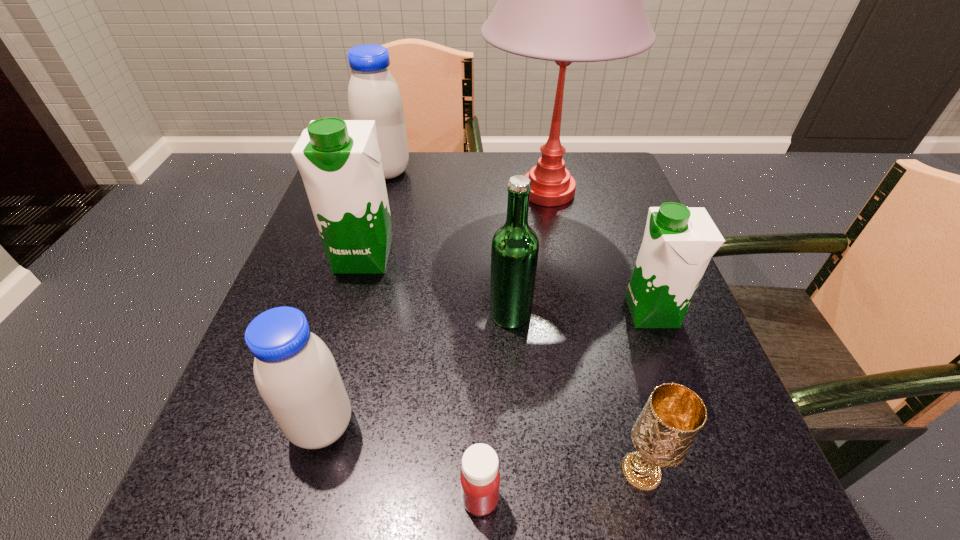
You are a GUI agent. You are given a task and a screenshot of the screen. Output one action in this format:
    pyautogui.click(x=<x>, y=<y>)
    Task: Click on the free space between the medicine and the second farthest soya milk
    The height and width of the screenshot is (540, 960).
    Given the screenshot: What is the action you would take?
    pyautogui.click(x=422, y=377)

Find the location of a particular element. This screenshot has height=540, width=960. blank region between the medicine and the beer bottle is located at coordinates (495, 406).

Where is `unoccupied position between the tallest object and the farther green soya milk`? unoccupied position between the tallest object and the farther green soya milk is located at coordinates (456, 224).

Find the location of `free space between the nearer blue soya milk and the light table lamp`. free space between the nearer blue soya milk and the light table lamp is located at coordinates (435, 309).

Identify the location of vacant space that is in between the right green soya milk and the green beer bottle. (581, 313).

What are the coordinates of `vacant space that's between the third nearest soya milk and the nearest soya milk` in the screenshot? It's located at (344, 341).

In order to click on object that ranks as the seventh closest to the farther blue soya milk in this screenshot , I will do `click(673, 416)`.

Choose which object is the sixth nearest neighbor to the right green soya milk. Please provide its 2D coordinates. Your answer should be formatted as a tuple, i.e. [(x, y)], where the tuple contains the x and y coordinates of a point satisfying the conditions above.

[(296, 374)]

I want to click on soya milk object that ranks as the third closest to the shortest object, so click(339, 160).

Identify the location of soya milk that is the closest to the light table lamp. (339, 160).